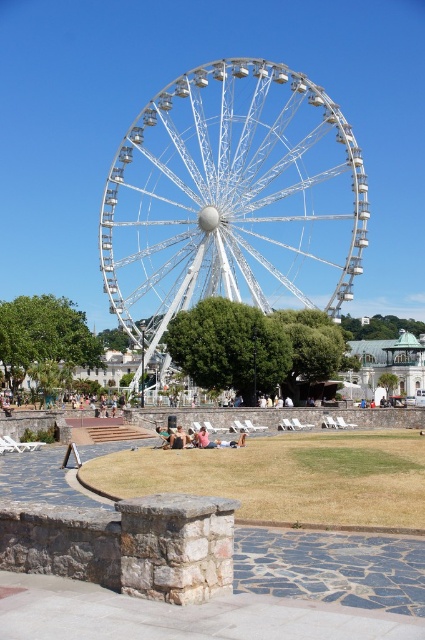
Looking at this image, between white metallic ferris wheel at center and beige fabric people at center, which one appears on the right side from the viewer's perspective?

white metallic ferris wheel at center

Does point (333, 131) come farther from viewer compared to point (159, 429)?

Yes, point (333, 131) is farther from viewer.

Locate an element on the screen. white metallic ferris wheel at center is located at coordinates (232, 200).